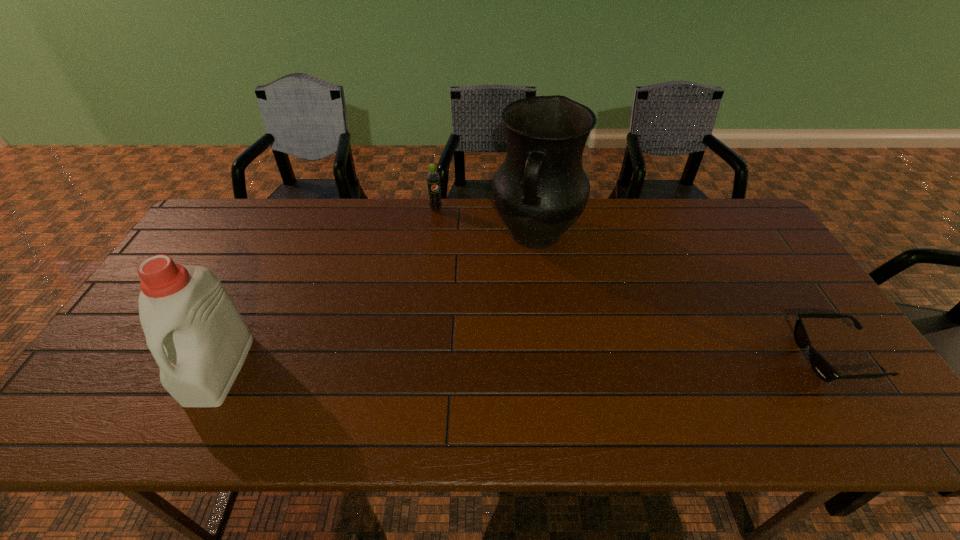
The height and width of the screenshot is (540, 960). In order to click on vacant spot on the desktop that is between the leftmost object and the sunglasses and is positioned on the handle side of the tallest object in this screenshot , I will do `click(486, 364)`.

You are a GUI agent. You are given a task and a screenshot of the screen. Output one action in this format:
    pyautogui.click(x=<x>, y=<y>)
    Task: Click on the vacant spot on the desktop that is between the second tallest object and the shortest object and is positioned on the front label of the soda
    Image resolution: width=960 pixels, height=540 pixels.
    Given the screenshot: What is the action you would take?
    pyautogui.click(x=498, y=363)